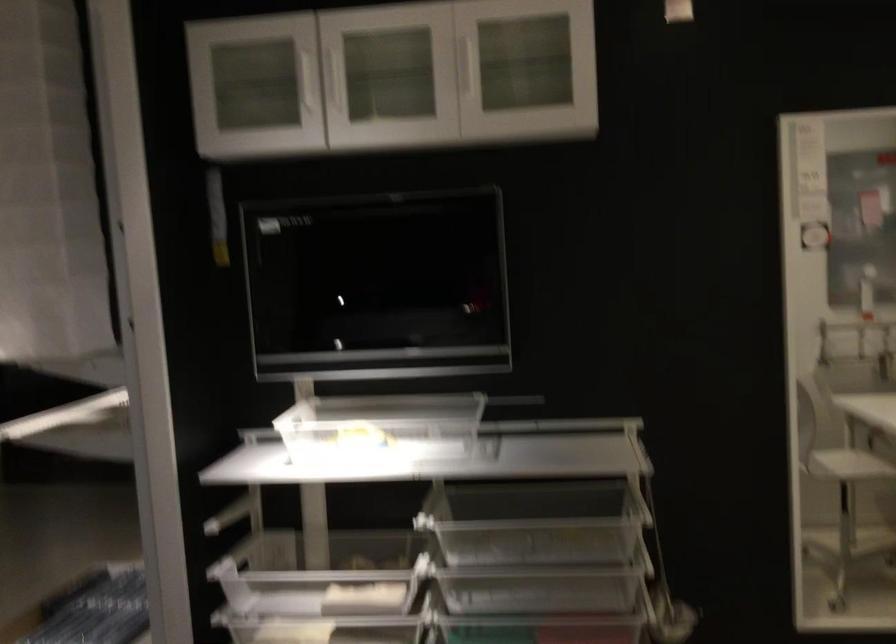
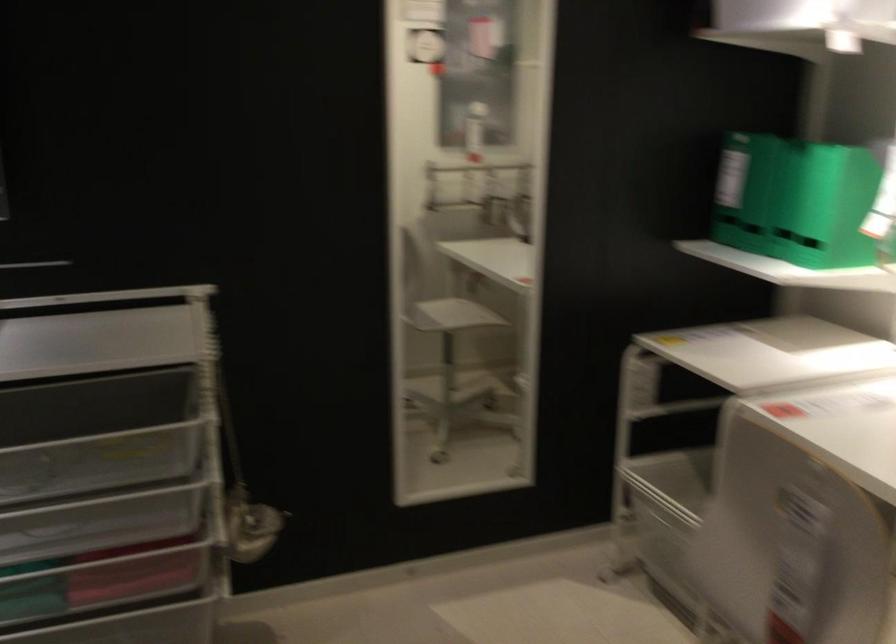
Which direction would the cameraman need to move to produce the second image?

The cameraman moved toward right, forward.